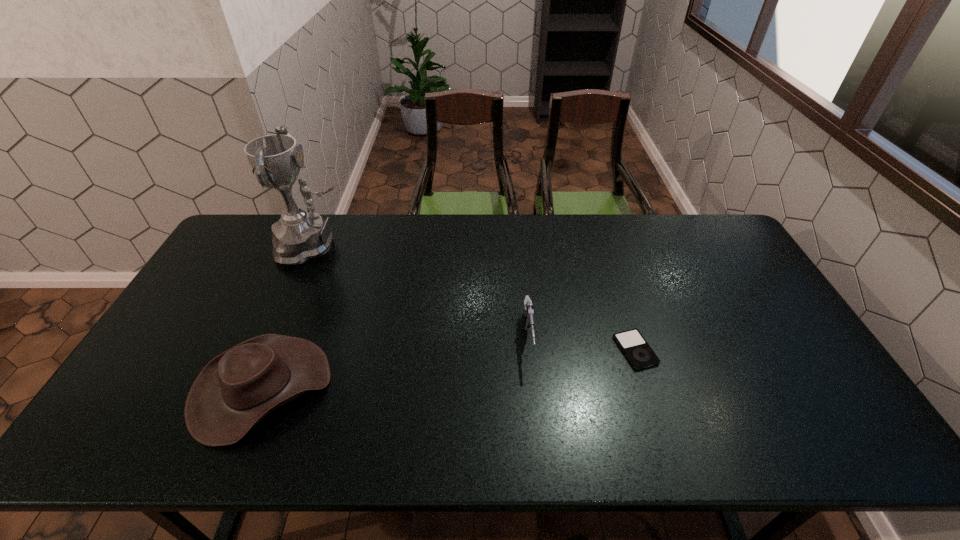
Locate an element on the screen. vacant area in the image that satisfies the following two spatial constraints: 1. on the side with emblem of the farthest object; 2. on the left side of the cowboy hat is located at coordinates (254, 388).

Where is `vacant region that satisfies the following two spatial constraints: 1. on the side with emblem of the shortest object; 2. on the right side of the farthest object`? This screenshot has height=540, width=960. vacant region that satisfies the following two spatial constraints: 1. on the side with emblem of the shortest object; 2. on the right side of the farthest object is located at coordinates (271, 350).

At what (x,y) coordinates should I click in order to perform the action: click on vacant region that satisfies the following two spatial constraints: 1. on the side with emblem of the iPod; 2. on the left side of the tallest object. Please return your answer as a coordinate pair (x, y). Looking at the image, I should click on (271, 350).

This screenshot has width=960, height=540. I want to click on free space that satisfies the following two spatial constraints: 1. on the side with emblem of the award; 2. on the left side of the cowboy hat, so click(x=254, y=388).

This screenshot has width=960, height=540. I want to click on vacant region that satisfies the following two spatial constraints: 1. at the barrel of the iPod; 2. on the left side of the second object from right to left, so click(530, 350).

Image resolution: width=960 pixels, height=540 pixels. Find the location of `free space that satisfies the following two spatial constraints: 1. on the side with emblem of the rightmost object; 2. on the right side of the tallest object`. free space that satisfies the following two spatial constraints: 1. on the side with emblem of the rightmost object; 2. on the right side of the tallest object is located at coordinates (271, 350).

Find the location of a particular element. vacant region that satisfies the following two spatial constraints: 1. on the side with emblem of the award; 2. on the left side of the shortest object is located at coordinates pyautogui.click(x=271, y=350).

This screenshot has height=540, width=960. In order to click on vacant space that satisfies the following two spatial constraints: 1. on the back side of the cowboy hat; 2. on the side with emblem of the award in this screenshot , I will do `click(321, 246)`.